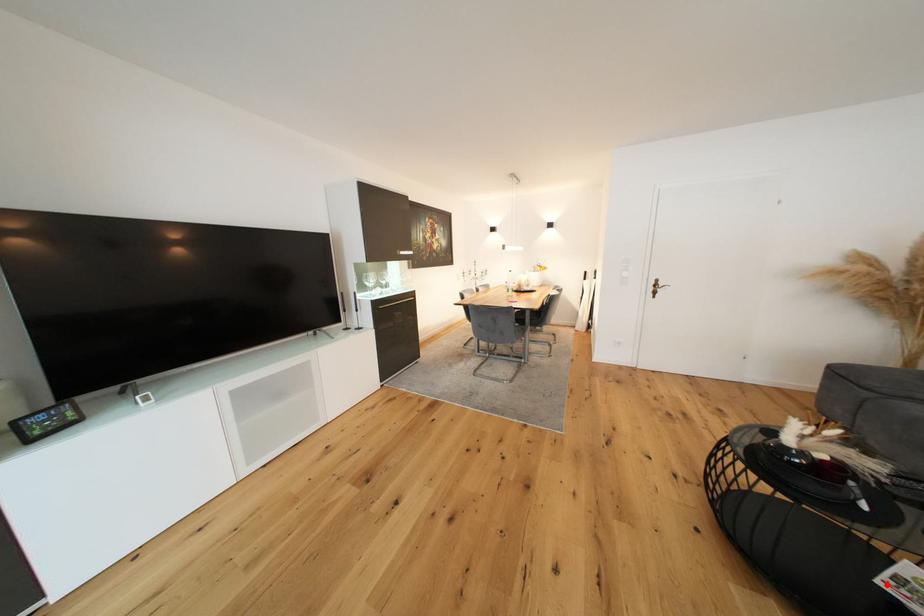
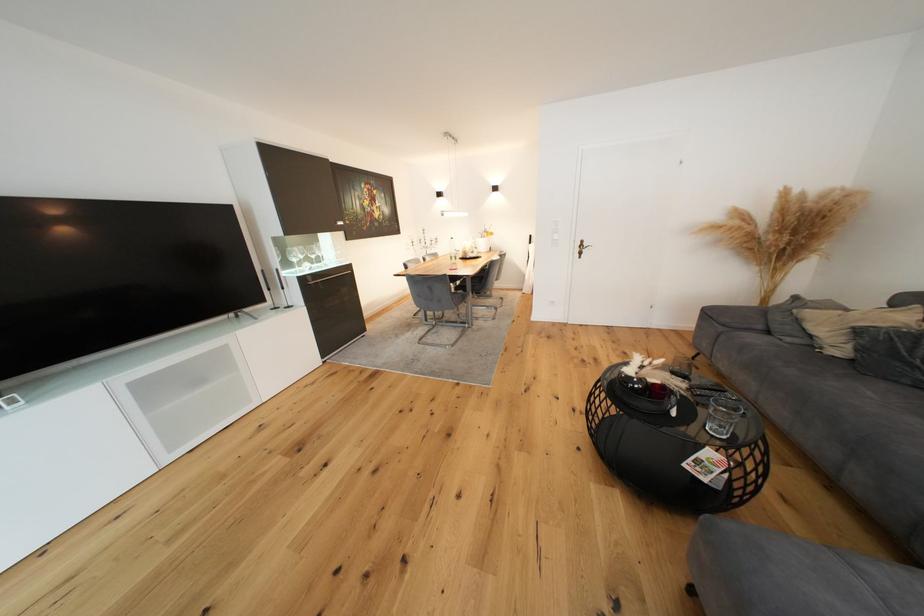
Where in the second image is the point corresponding to the highlighted location from the first image?

(691, 467)